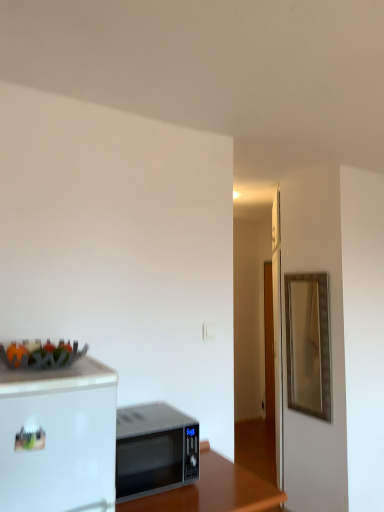
This screenshot has width=384, height=512. What do you see at coordinates (308, 344) in the screenshot?
I see `gold metallic mirror at right` at bounding box center [308, 344].

At what (x,y) coordinates should I click in order to perform the action: click on black glossy microwave at lower center. Please return your answer as a coordinate pair (x, y). Looking at the image, I should click on (213, 490).

Describe the element at coordinates (213, 490) in the screenshot. I see `black glossy microwave at lower center` at that location.

In order to click on metallic fruit basket at upper left in this screenshot , I will do `click(41, 355)`.

Find the location of a particular element. silver metallic microwave at center is located at coordinates (154, 450).

Is black glossy microwave at lower center turned away from gold metallic mirror at right?

That's not correct — black glossy microwave at lower center is not looking away from gold metallic mirror at right.

Relative to gold metallic mirror at right, is black glossy microwave at lower center in front or behind?

Clearly, black glossy microwave at lower center is in front of gold metallic mirror at right.

Considering the positions of points (251, 511) and (309, 296), is point (251, 511) farther from camera compared to point (309, 296)?

That is False.

Does black glossy microwave at lower center have a smaller size compared to gold metallic mirror at right?

No.

Is gold metallic mirror at right facing away from silver metallic microwave at center?

gold metallic mirror at right does not have its back to silver metallic microwave at center.

Is gold metallic mirror at right situated inside silver metallic microwave at center or outside?

gold metallic mirror at right lies outside silver metallic microwave at center.

Would you consider gold metallic mirror at right to be distant from silver metallic microwave at center?

Yes, gold metallic mirror at right and silver metallic microwave at center are quite far apart.

Does point (322, 287) lie in front of point (124, 446)?

No.

Can you confirm if metallic fruit basket at upper left is smaller than black glossy microwave at lower center?

Indeed, metallic fruit basket at upper left has a smaller size compared to black glossy microwave at lower center.

Is metallic fruit basket at upper left facing towards black glossy microwave at lower center?

No, metallic fruit basket at upper left does not turn towards black glossy microwave at lower center.

From the picture: From the image's perspective, which is below, metallic fruit basket at upper left or black glossy microwave at lower center?

From the image's view, black glossy microwave at lower center is below.

Consider the image. From a real-world perspective, is metallic fruit basket at upper left positioned over black glossy microwave at lower center based on gravity?

Yes, from a real-world perspective, metallic fruit basket at upper left is on top of black glossy microwave at lower center.

Is black glossy microwave at lower center taller or shorter than metallic fruit basket at upper left?

Considering their sizes, black glossy microwave at lower center has more height than metallic fruit basket at upper left.

Locate an element on the screen. The image size is (384, 512). food in front of the black glossy microwave at lower center is located at coordinates (41, 355).

Is black glossy microwave at lower center positioned in front of metallic fruit basket at upper left?

No.

Considering the positions of objects black glossy microwave at lower center and metallic fruit basket at upper left in the image provided, who is more to the right, black glossy microwave at lower center or metallic fruit basket at upper left?

black glossy microwave at lower center.

Where is `microwave oven above the black glossy microwave at lower center (from a real-world perspective)`? Image resolution: width=384 pixels, height=512 pixels. microwave oven above the black glossy microwave at lower center (from a real-world perspective) is located at coordinates (154, 450).

Is silver metallic microwave at center not near black glossy microwave at lower center?

silver metallic microwave at center is actually quite close to black glossy microwave at lower center.

Is point (183, 455) positioned in front of point (261, 506)?

Yes, point (183, 455) is in front of point (261, 506).

How many degrees apart are the facing directions of silver metallic microwave at center and black glossy microwave at lower center?

silver metallic microwave at center and black glossy microwave at lower center are facing 0.252 degrees away from each other.

Which object is closer to the camera, metallic fruit basket at upper left or silver metallic microwave at center?

metallic fruit basket at upper left is closer to the camera.

Considering the relative positions of metallic fruit basket at upper left and silver metallic microwave at center in the image provided, is metallic fruit basket at upper left to the left of silver metallic microwave at center from the viewer's perspective?

Yes.

Is point (11, 352) positioned before point (191, 479)?

Yes, it is.

What's the angular difference between metallic fruit basket at upper left and silver metallic microwave at center's facing directions?

1.53 degrees.

Based on the photo, does silver metallic microwave at center have a larger size compared to gold metallic mirror at right?

Indeed, silver metallic microwave at center has a larger size compared to gold metallic mirror at right.

Is silver metallic microwave at center facing away from gold metallic mirror at right?

That's not correct — silver metallic microwave at center is not looking away from gold metallic mirror at right.

Is silver metallic microwave at center next to gold metallic mirror at right?

silver metallic microwave at center and gold metallic mirror at right are clearly separated.

How distant is silver metallic microwave at center from gold metallic mirror at right?

silver metallic microwave at center is 1.56 meters from gold metallic mirror at right.

Where is `table that is below the gold metallic mirror at right (from the image's perspective)`? This screenshot has width=384, height=512. table that is below the gold metallic mirror at right (from the image's perspective) is located at coordinates (213, 490).

You are a GUI agent. You are given a task and a screenshot of the screen. Output one action in this format:
    pyautogui.click(x=<x>, y=<y>)
    Task: Click on the microwave oven on the left of gold metallic mirror at right
    This screenshot has width=384, height=512.
    Given the screenshot: What is the action you would take?
    pyautogui.click(x=154, y=450)

Which object lies further to the anchor point silver metallic microwave at center, gold metallic mirror at right or metallic fruit basket at upper left?

Among the two, gold metallic mirror at right is located further to silver metallic microwave at center.

Based on their spatial positions, is black glossy microwave at lower center or silver metallic microwave at center closer to metallic fruit basket at upper left?

silver metallic microwave at center.

Estimate the real-world distances between objects in this image. Which object is closer to gold metallic mirror at right, metallic fruit basket at upper left or silver metallic microwave at center?

Based on the image, silver metallic microwave at center appears to be nearer to gold metallic mirror at right.

Looking at the image, which one is located further to black glossy microwave at lower center, gold metallic mirror at right or silver metallic microwave at center?

Among the two, gold metallic mirror at right is located further to black glossy microwave at lower center.

Estimate the real-world distances between objects in this image. Which object is further from gold metallic mirror at right, black glossy microwave at lower center or silver metallic microwave at center?

The object further to gold metallic mirror at right is silver metallic microwave at center.

When comparing their distances from black glossy microwave at lower center, does silver metallic microwave at center or metallic fruit basket at upper left seem further?

metallic fruit basket at upper left is further to black glossy microwave at lower center.

Which object lies further to the anchor point black glossy microwave at lower center, gold metallic mirror at right or metallic fruit basket at upper left?

gold metallic mirror at right is further to black glossy microwave at lower center.

When comparing their distances from gold metallic mirror at right, does black glossy microwave at lower center or metallic fruit basket at upper left seem closer?

Based on the image, black glossy microwave at lower center appears to be nearer to gold metallic mirror at right.

Where is `microwave oven between metallic fruit basket at upper left and gold metallic mirror at right from front to back`? microwave oven between metallic fruit basket at upper left and gold metallic mirror at right from front to back is located at coordinates (154, 450).

You are a GUI agent. You are given a task and a screenshot of the screen. Output one action in this format:
    pyautogui.click(x=<x>, y=<y>)
    Task: Click on the table located between metallic fruit basket at upper left and gold metallic mirror at right in the depth direction
    
    Given the screenshot: What is the action you would take?
    pyautogui.click(x=213, y=490)

The image size is (384, 512). I want to click on microwave oven between black glossy microwave at lower center and gold metallic mirror at right from front to back, so click(154, 450).

You are a GUI agent. You are given a task and a screenshot of the screen. Output one action in this format:
    pyautogui.click(x=<x>, y=<y>)
    Task: Click on the microwave oven between metallic fruit basket at upper left and black glossy microwave at lower center in the up-down direction
    
    Given the screenshot: What is the action you would take?
    pyautogui.click(x=154, y=450)